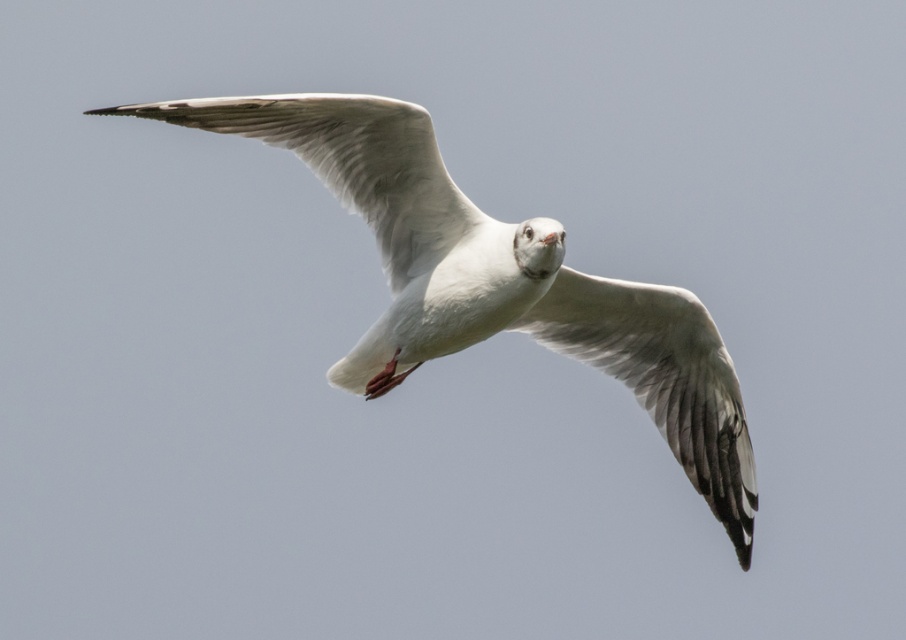
You are a photographer trying to capture the seagull in flight. You notice the white feathered bird at center and the white feathered wing at upper center. Which object is closer to the camera based on their positions?

The white feathered bird at center is positioned under the white feathered wing at upper center, meaning the wing is closer to the camera.

You are a photographer trying to capture the white feathered bird at center and the white feathered wing at center in a single shot. Which object should you adjust your camera focus on first if you want to ensure both are in frame?

The white feathered bird at center is to the left of white feathered wing at center. To ensure both are in frame, focus on the white feathered bird at center first as it is positioned further left, then adjust the camera to include the white feathered wing at center on the right side.